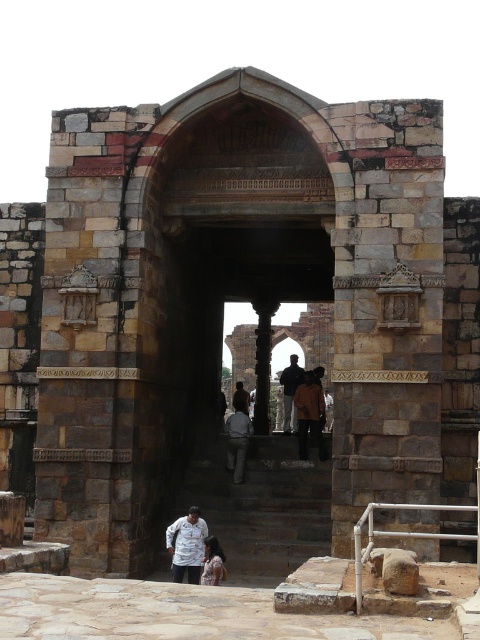
You are a tailor trying to decide which pair of pants to alter. You have the orange fabric pants at center and the dark blue jeans at center in front of you. Which pants have a narrower width?

The orange fabric pants at center have a narrower width than the dark blue jeans at center.